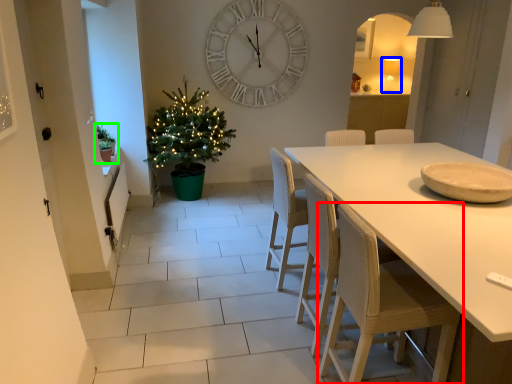
Question: Estimate the real-world distances between objects in this image. Which object is farther from chair (highlighted by a red box), lamp (highlighted by a blue box) or houseplant (highlighted by a green box)?

Choices:
 (A) lamp
 (B) houseplant

Answer: (A)